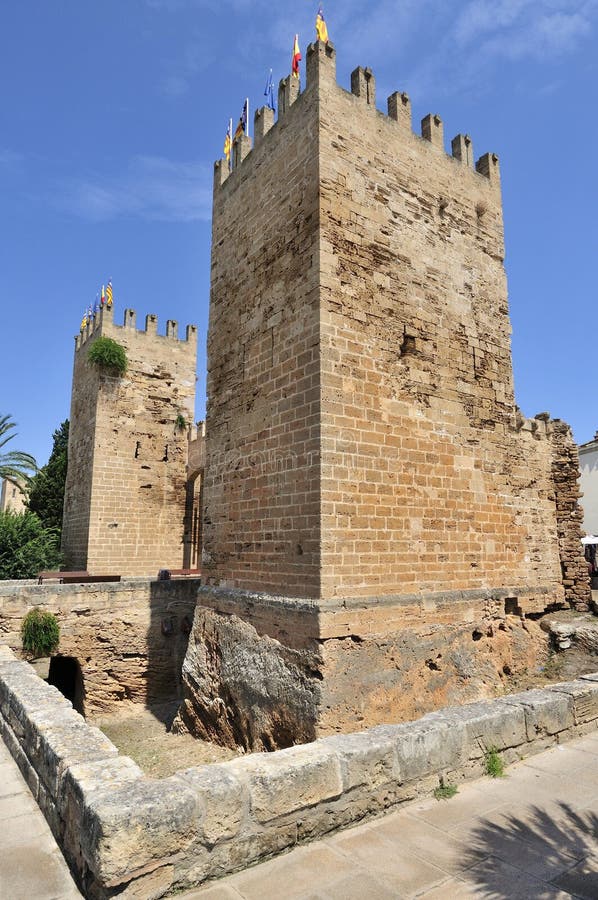
This screenshot has height=900, width=598. In order to click on small wall in this screenshot , I will do `click(338, 785)`, `click(51, 722)`.